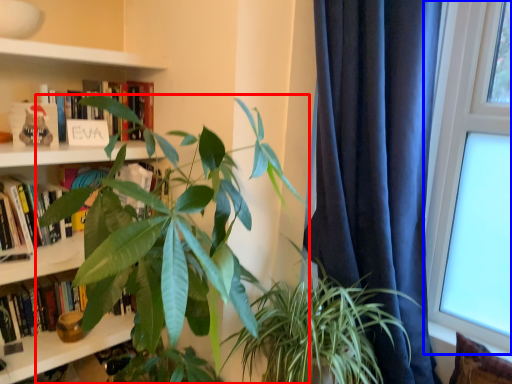
Question: Which object is closer to the camera taking this photo, houseplant (highlighted by a red box) or window (highlighted by a blue box)?

Choices:
 (A) houseplant
 (B) window

Answer: (A)